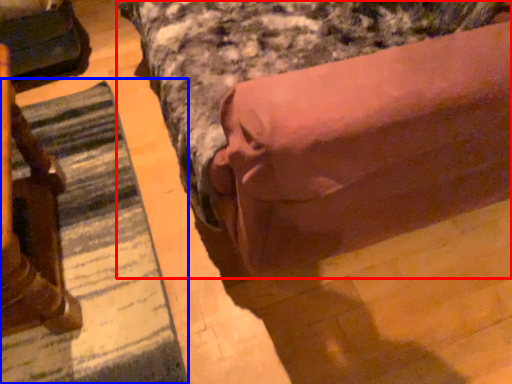
Question: Among these objects, which one is farthest to the camera, bed (highlighted by a red box) or mat (highlighted by a blue box)?

Choices:
 (A) bed
 (B) mat

Answer: (B)